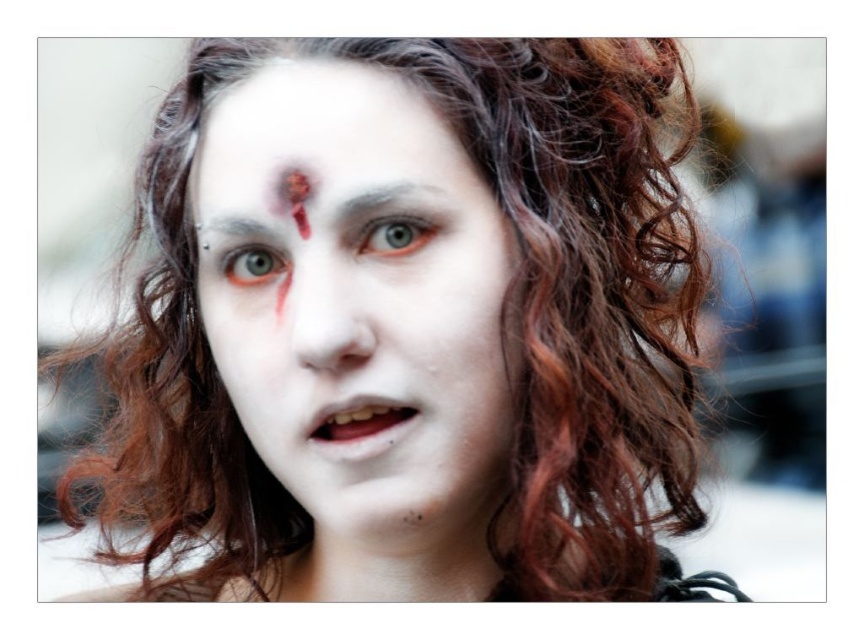
You are an artist analyzing the facial features of the person in the image. The coordinates point to a specific area on their face. Based on the coordinates provided, which facial feature is located at point (334,154)?

The coordinates point to the white matte forehead at center.

You are an artist analyzing the face in the image. You need to locate the white matte forehead at center. What are its coordinates?

The white matte forehead at center is located at point (334, 154).

You are a makeup artist preparing to apply face paint to a client who has a white matte face at center. You have a tube of white matte face paint at center. If you want to apply the new paint 1 inch away from the existing face paint, is that possible?

The white matte face paint at center is already 3.08 inches from the white matte face at center. Since 3.08 inches is greater than 1 inch, you can apply the new paint 1 inch away from the existing face paint without overlapping.